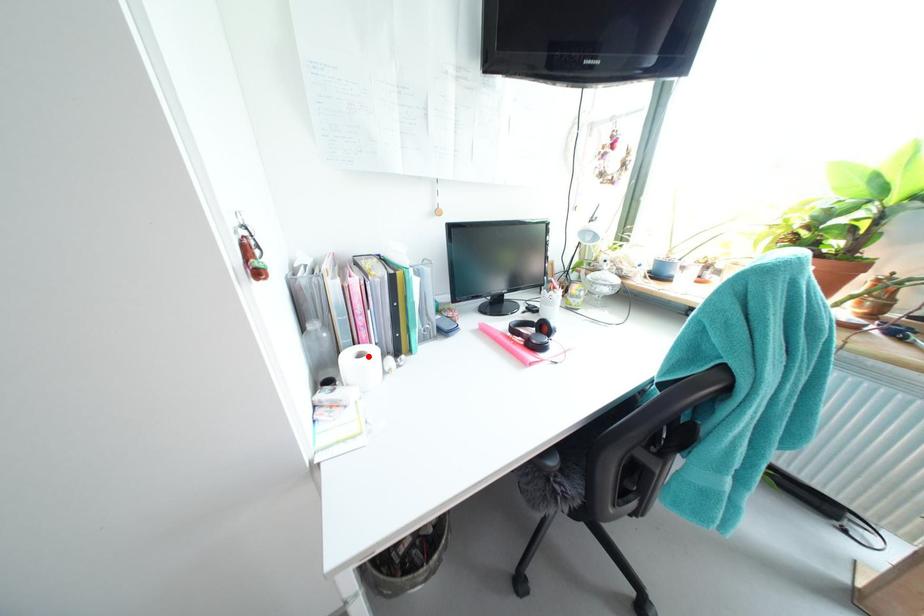
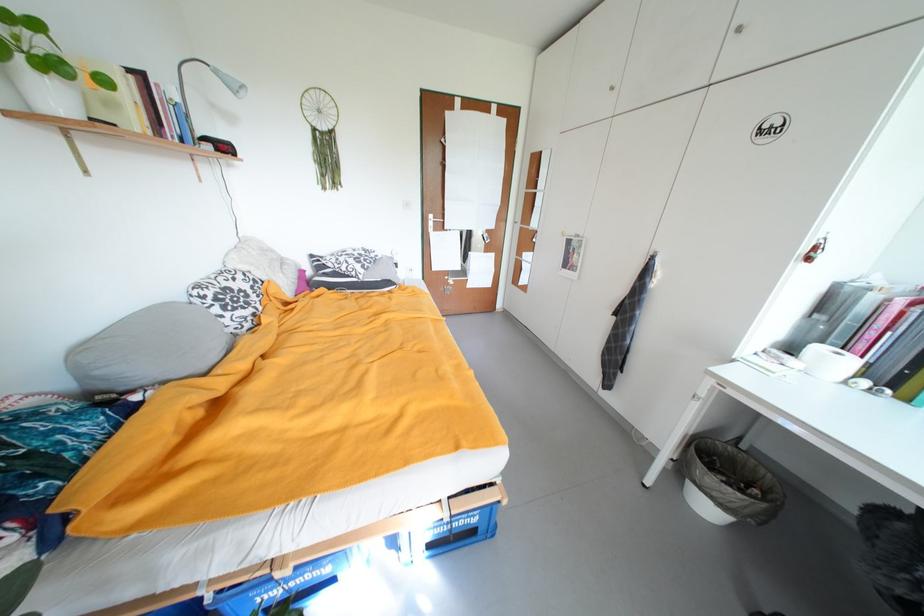
In the second image, find the point that corresponds to the highlighted location in the first image.

(845, 355)